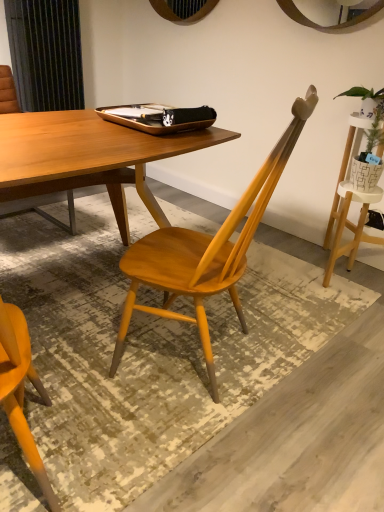
You are a GUI agent. You are given a task and a screenshot of the screen. Output one action in this format:
    pyautogui.click(x=<x>, y=<y>)
    Task: Click on the free point to the right of matte wood chair at center
    The height and width of the screenshot is (512, 384).
    Given the screenshot: What is the action you would take?
    pyautogui.click(x=296, y=329)